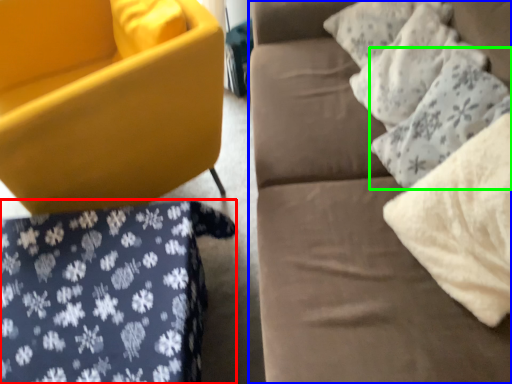
Question: Which is farther away from bedding (highlighted by a red box)? studio couch (highlighted by a blue box) or pillow (highlighted by a green box)?

Choices:
 (A) studio couch
 (B) pillow

Answer: (B)